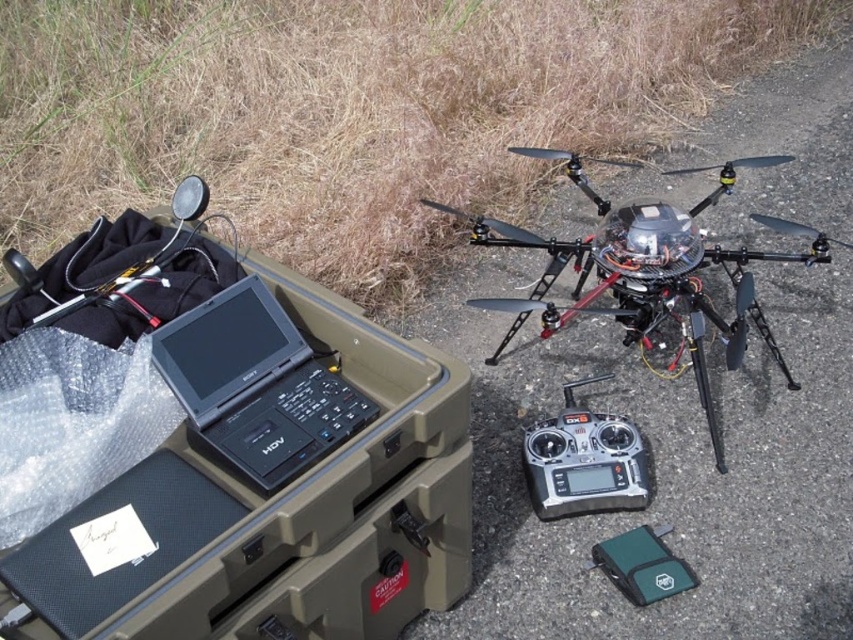
You need to place both the black matte laptop at center and the black plastic remote control at center on a shelf that can only hold items up to 15 inches wide. Given their widths, will both items fit on the shelf together?

The black matte laptop at center is wider than the black plastic remote control at center. However, without knowing their exact widths, we cannot determine if their combined width exceeds the 15 inch limit. More information is needed.